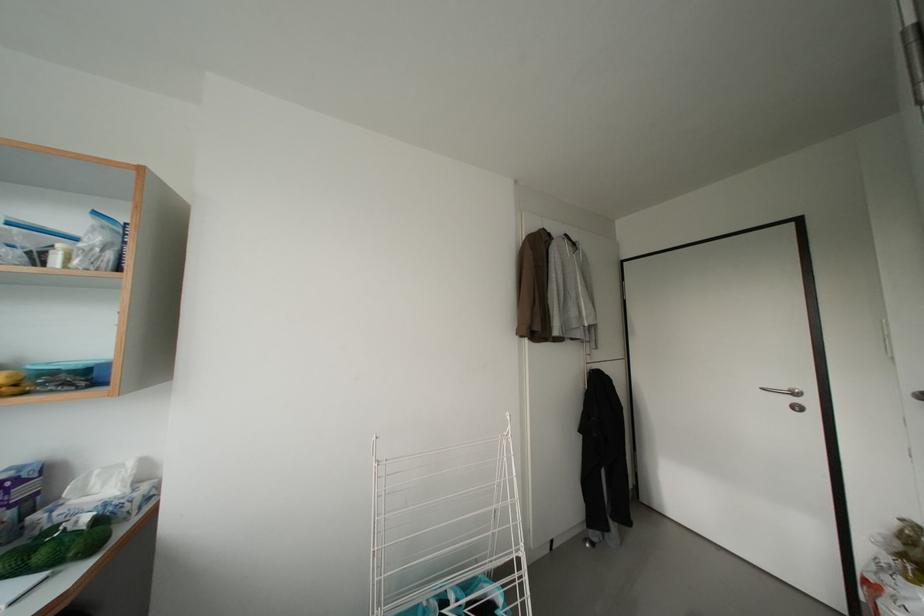
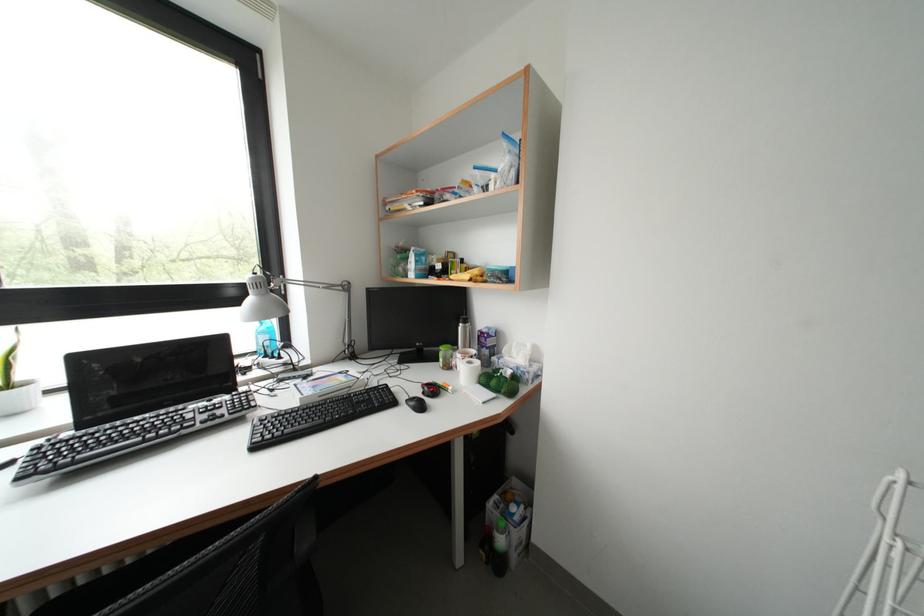
Locate, in the second image, the point that corresponds to the point at 49,561 in the first image.

(500, 387)